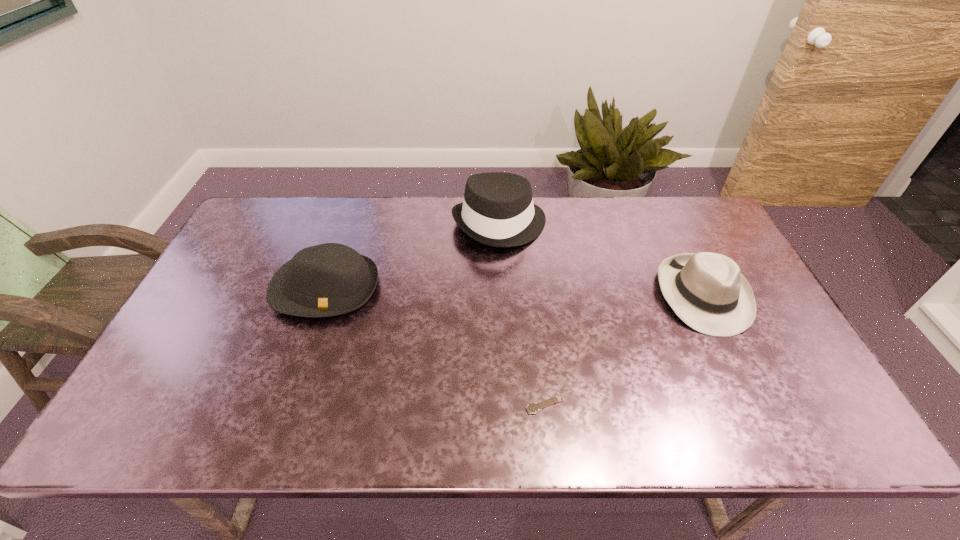
This screenshot has width=960, height=540. Find the location of `object that is at the far edge`. object that is at the far edge is located at coordinates (497, 210).

Locate an element on the screen. object situated at the near edge is located at coordinates (532, 408).

Where is `object present at the right edge`? This screenshot has width=960, height=540. object present at the right edge is located at coordinates (707, 291).

Locate an element on the screen. This screenshot has height=540, width=960. free space at the far edge of the desktop is located at coordinates (405, 207).

Where is `free space at the near edge of the desktop`? The image size is (960, 540). free space at the near edge of the desktop is located at coordinates (585, 411).

Image resolution: width=960 pixels, height=540 pixels. Find the location of `vacant region at the left edge of the desktop`. vacant region at the left edge of the desktop is located at coordinates (225, 287).

Identify the location of vacant position at the right edge of the desktop. The width and height of the screenshot is (960, 540). (736, 343).

In the image, there is a desktop. Where is `vacant space at the far left corner`? vacant space at the far left corner is located at coordinates (271, 230).

At what (x,y) coordinates should I click in order to perform the action: click on free region at the far right corner of the desktop. Please return your answer as a coordinate pair (x, y). The width and height of the screenshot is (960, 540). Looking at the image, I should click on [690, 215].

Image resolution: width=960 pixels, height=540 pixels. I want to click on empty location between the rightmost fedora and the shortest object, so click(x=624, y=349).